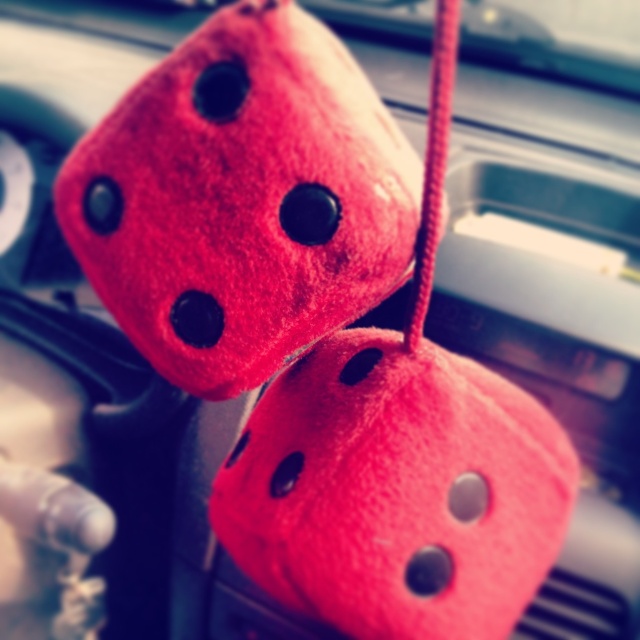
Question: Which point is farther from the camera taking this photo?

Choices:
 (A) (262, 488)
 (B) (291, 54)

Answer: (A)

Question: Considering the relative positions of fuzzy red dice at upper center and fuzzy red dice at center in the image provided, where is fuzzy red dice at upper center located with respect to fuzzy red dice at center?

Choices:
 (A) below
 (B) above

Answer: (B)

Question: Which point is closer to the camera taking this photo?

Choices:
 (A) (172, 234)
 (B) (362, 337)

Answer: (A)

Question: Observing the image, what is the correct spatial positioning of fuzzy red dice at upper center in reference to fuzzy red dice at center?

Choices:
 (A) below
 (B) above

Answer: (B)

Question: Is fuzzy red dice at upper center positioned at the back of fuzzy red dice at center?

Choices:
 (A) yes
 (B) no

Answer: (B)

Question: Which point appears farthest from the camera in this image?

Choices:
 (A) 390,161
 (B) 563,460

Answer: (B)